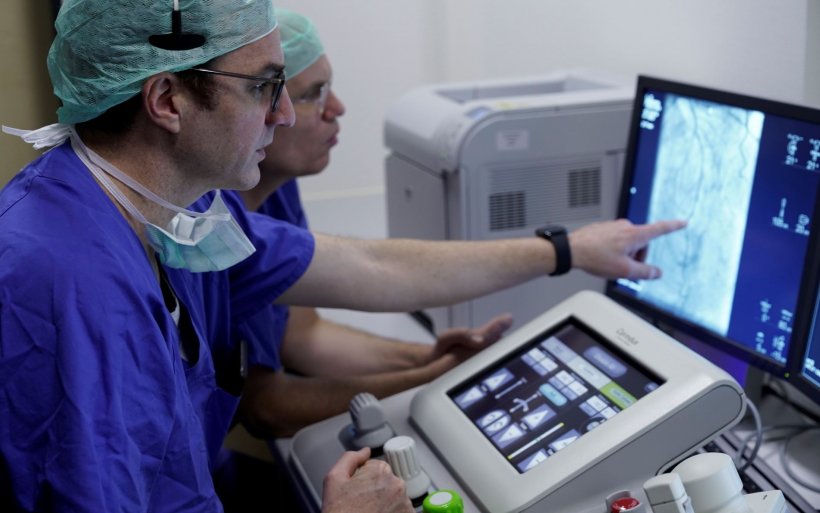
Find the location of a particular element. printer is located at coordinates (527, 152).